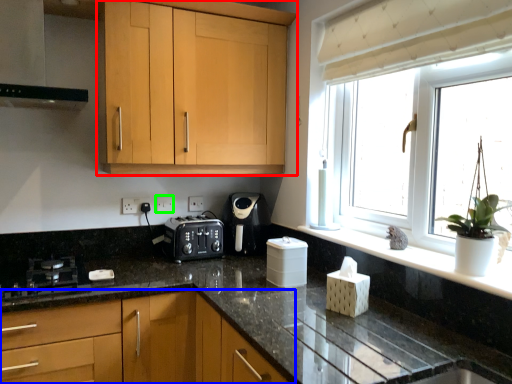
Question: Which object is the closest to the cabinetry (highlighted by a red box)? Choose among these: cabinetry (highlighted by a blue box) or electric outlet (highlighted by a green box).

Choices:
 (A) cabinetry
 (B) electric outlet

Answer: (B)